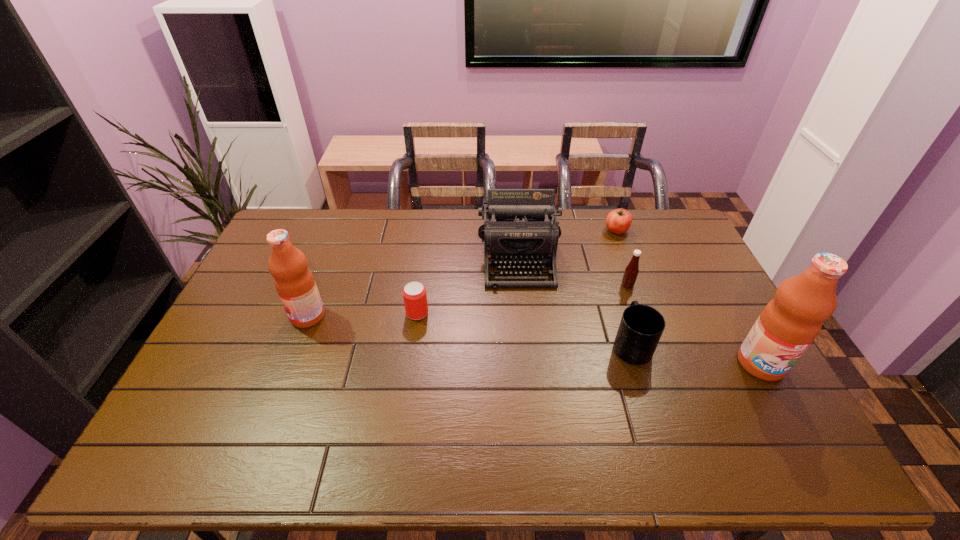
Find the location of a particular element. object that is the fifth closest one to the apple is located at coordinates (414, 293).

Where is `vacant area that satisfies the following two spatial constraints: 1. on the keyboard of the third object from left to right; 2. on the right side of the Tabasco sauce`? This screenshot has width=960, height=540. vacant area that satisfies the following two spatial constraints: 1. on the keyboard of the third object from left to right; 2. on the right side of the Tabasco sauce is located at coordinates (520, 285).

Find the location of a particular element. vacant area that satisfies the following two spatial constraints: 1. on the keyboard of the Tabasco sauce; 2. on the right side of the third tallest object is located at coordinates (520, 285).

Identify the location of vacant area in the image that satisfies the following two spatial constraints: 1. on the front label of the left fruit juice; 2. on the side of the mug with the handle. The height and width of the screenshot is (540, 960). (297, 346).